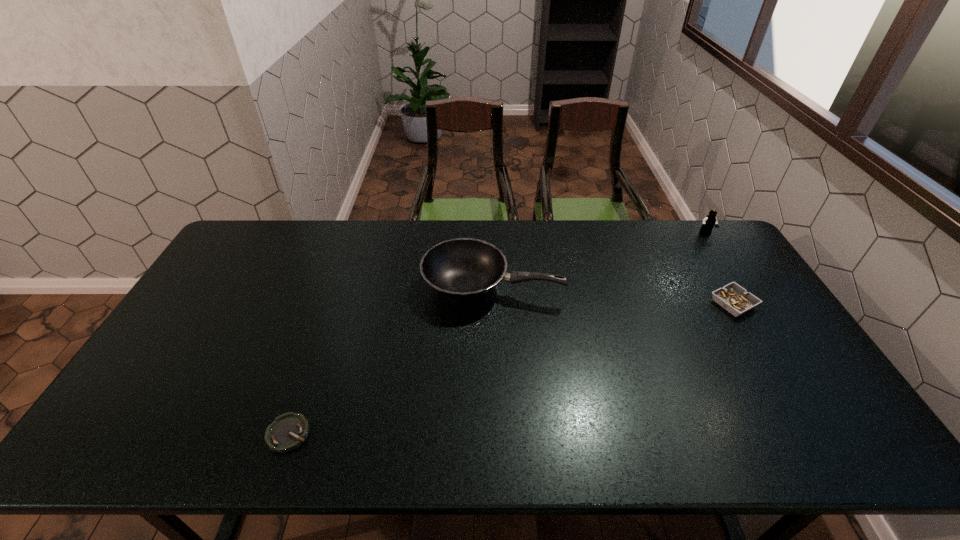
Where is `frying pan that is at the far edge`? This screenshot has width=960, height=540. frying pan that is at the far edge is located at coordinates 463,269.

The height and width of the screenshot is (540, 960). I want to click on Lego located in the far edge section of the desktop, so click(709, 221).

Where is `object present at the near edge`? This screenshot has height=540, width=960. object present at the near edge is located at coordinates (288, 431).

In order to click on Lego located at the right edge in this screenshot , I will do `click(709, 221)`.

Locate an element on the screen. ashtray that is at the right edge is located at coordinates coord(735,299).

Where is `object that is positioned at the far right corner`? This screenshot has height=540, width=960. object that is positioned at the far right corner is located at coordinates (709, 221).

The height and width of the screenshot is (540, 960). Find the location of `free space at the far edge of the desktop`. free space at the far edge of the desktop is located at coordinates (375, 242).

At what (x,y) coordinates should I click in order to perform the action: click on vacant space at the near edge of the desktop. Please return your answer as a coordinate pair (x, y). The width and height of the screenshot is (960, 540). Looking at the image, I should click on (303, 449).

This screenshot has height=540, width=960. I want to click on free space at the left edge of the desktop, so click(218, 273).

In the image, there is a desktop. At what (x,y) coordinates should I click in order to perform the action: click on vacant space at the right edge. Please return your answer as a coordinate pair (x, y). The width and height of the screenshot is (960, 540). Looking at the image, I should click on (774, 393).